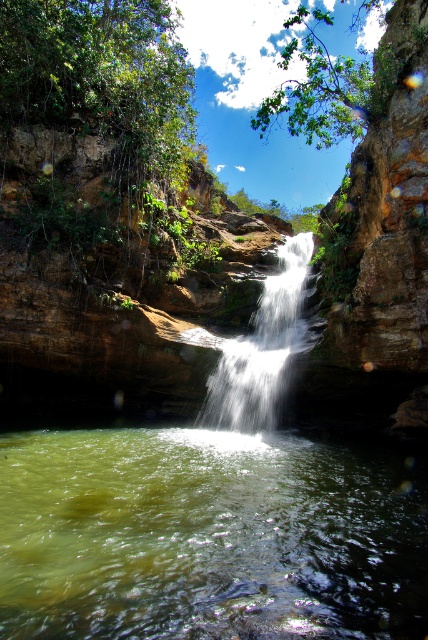
Question: Which point is farther to the camera?

Choices:
 (A) white silky waterfall at center
 (B) green translucent water at center

Answer: (A)

Question: Can you confirm if green translucent water at center is bigger than white silky waterfall at center?

Choices:
 (A) yes
 (B) no

Answer: (B)

Question: Which point is closer to the camera?

Choices:
 (A) (287, 323)
 (B) (392, 582)

Answer: (B)

Question: Observing the image, what is the correct spatial positioning of green translucent water at center in reference to white silky waterfall at center?

Choices:
 (A) left
 (B) right

Answer: (A)

Question: Is green translucent water at center wider than white silky waterfall at center?

Choices:
 (A) no
 (B) yes

Answer: (B)

Question: Among these objects, which one is nearest to the camera?

Choices:
 (A) white silky waterfall at center
 (B) green translucent water at center

Answer: (B)